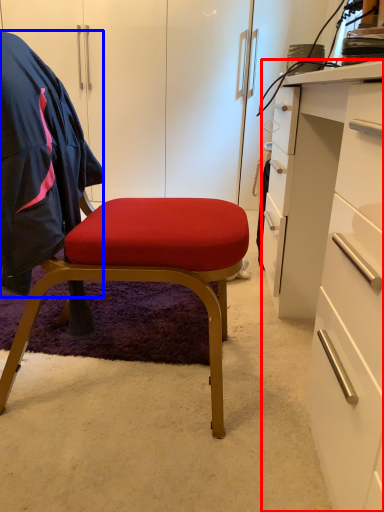
Question: Which object appears closest to the camera in this image, desk (highlighted by a red box) or clothing (highlighted by a blue box)?

Choices:
 (A) desk
 (B) clothing

Answer: (A)